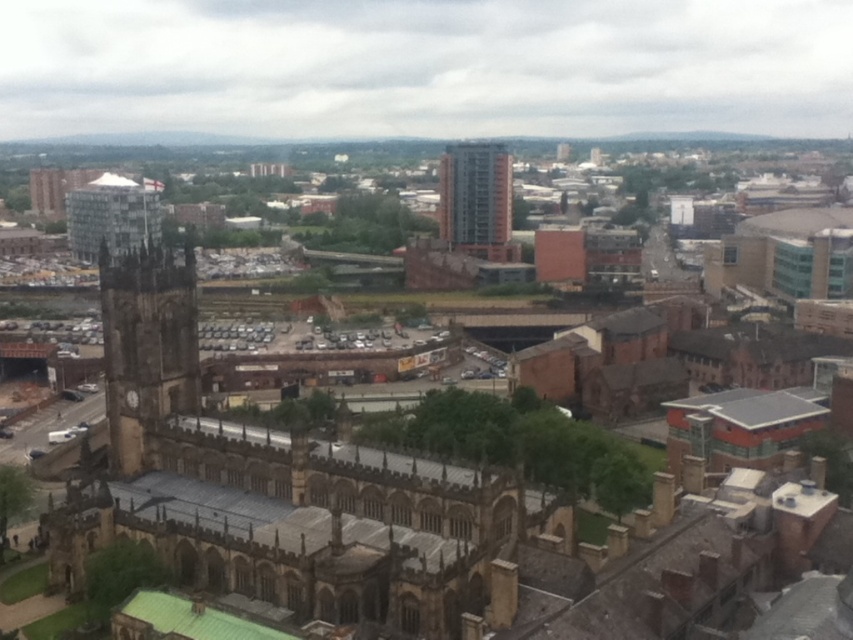
Can you confirm if orange brick building at center is positioned to the left of matte glass tower at upper left?

No, orange brick building at center is not to the left of matte glass tower at upper left.

Does orange brick building at center have a smaller size compared to matte glass tower at upper left?

Yes, orange brick building at center is smaller than matte glass tower at upper left.

You are a GUI agent. You are given a task and a screenshot of the screen. Output one action in this format:
    pyautogui.click(x=<x>, y=<y>)
    Task: Click on the orange brick building at center
    
    Given the screenshot: What is the action you would take?
    pyautogui.click(x=476, y=198)

Is point (143, 387) closer to viewer compared to point (132, 230)?

Yes, point (143, 387) is closer to viewer.

Locate an element on the screen. The image size is (853, 640). brown stone clock tower at left is located at coordinates (146, 346).

Is brown stone clock tower at left below orange brick building at center?

Correct, brown stone clock tower at left is located below orange brick building at center.

Is brown stone clock tower at left in front of orange brick building at center?

Yes, brown stone clock tower at left is in front of orange brick building at center.

Is point (183, 280) farther from viewer compared to point (459, 176)?

That is False.

Find the location of a particular element. brown stone clock tower at left is located at coordinates (146, 346).